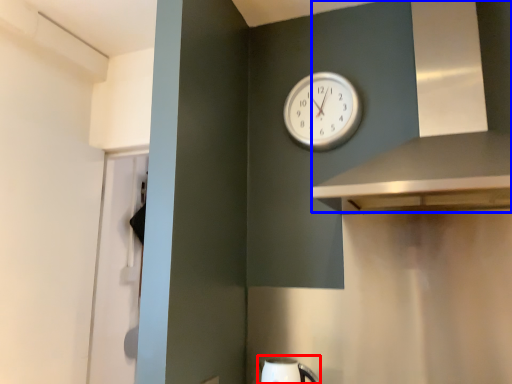
Question: Among these objects, which one is farthest to the camera, sink (highlighted by a red box) or vent (highlighted by a blue box)?

Choices:
 (A) sink
 (B) vent

Answer: (A)